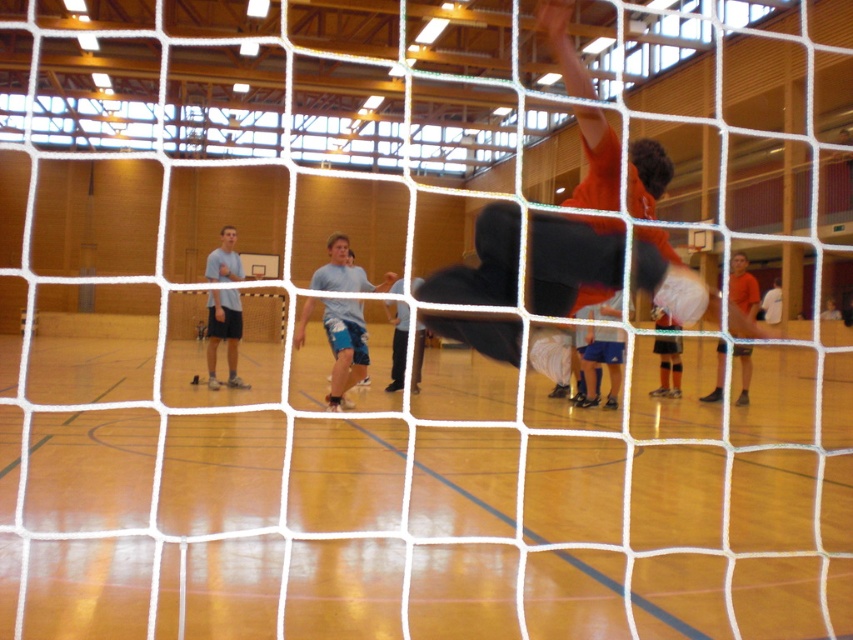
You are a photographer positioned behind the volleyball net. You want to capture a photo of the orange jersey shorts at center and the orange jersey at right. Based on their positions, which object should you focus on first to ensure both are in frame?

The orange jersey shorts at center is below orange jersey at right, so you should focus on the orange jersey at right first to ensure both are in frame.